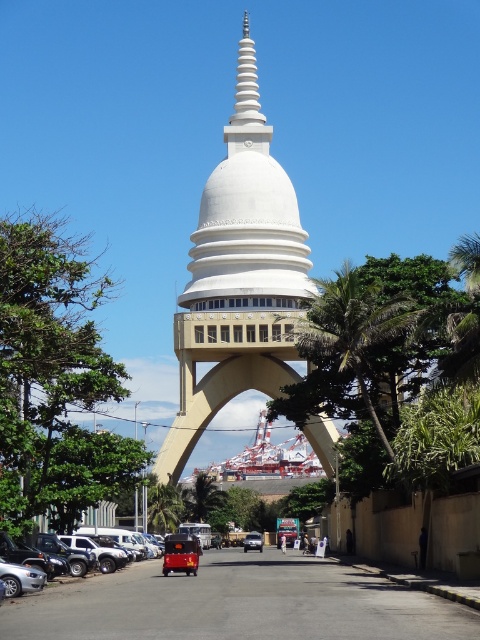
Can you confirm if white smooth stupa at center is taller than metallic silver car at center?

Correct, white smooth stupa at center is much taller as metallic silver car at center.

Looking at this image, who is positioned more to the left, white smooth stupa at center or metallic silver car at center?

white smooth stupa at center

Describe the element at coordinates (239, 276) in the screenshot. I see `white smooth stupa at center` at that location.

Find the location of a particular element. The image size is (480, 640). white smooth stupa at center is located at coordinates (239, 276).

Can you confirm if silver metallic car at lower left is positioned above metallic silver car at center?

Yes.

Who is more forward, (71, 566) or (261, 540)?

Point (71, 566) is more forward.

Who is more forward, (106,564) or (254,538)?

Positioned in front is point (106,564).

This screenshot has height=640, width=480. Find the location of `silver metallic car at lower left`. silver metallic car at lower left is located at coordinates (94, 554).

This screenshot has width=480, height=640. What do you see at coordinates (239, 276) in the screenshot?
I see `white smooth stupa at center` at bounding box center [239, 276].

Is white smooth stupa at center below silver metallic car at lower left?

Incorrect, white smooth stupa at center is not positioned below silver metallic car at lower left.

Describe the element at coordinates (239, 276) in the screenshot. The image size is (480, 640). I see `white smooth stupa at center` at that location.

Find the location of a particular element. white smooth stupa at center is located at coordinates pos(239,276).